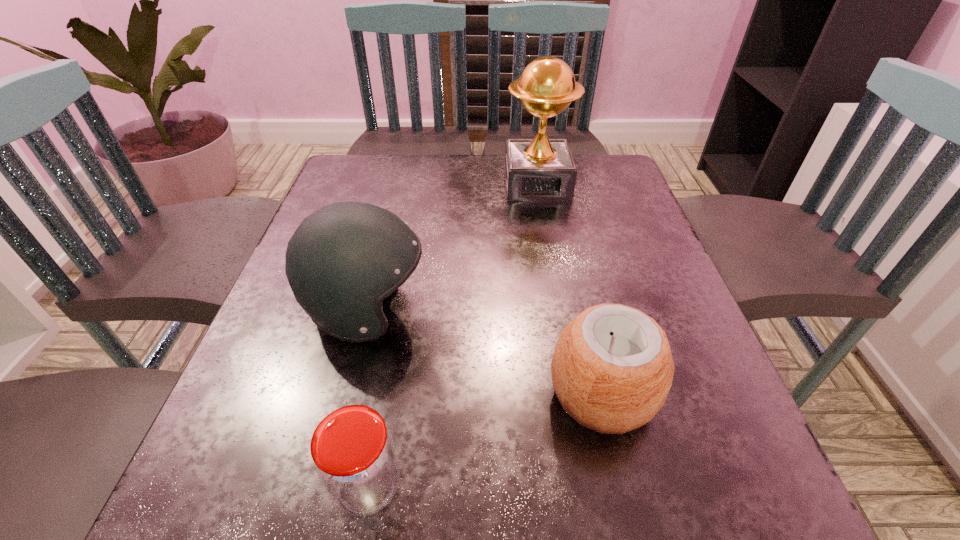
Find the location of a particular element. award is located at coordinates (541, 169).

You are a GUI agent. You are given a task and a screenshot of the screen. Output one action in this format:
    pyautogui.click(x=<x>, y=<y>)
    Task: Click on the farthest object
    
    Given the screenshot: What is the action you would take?
    pyautogui.click(x=541, y=169)

This screenshot has width=960, height=540. Find the location of `football helmet`. football helmet is located at coordinates (343, 260).

Locate an element on the screen. coconut is located at coordinates (612, 368).

The width and height of the screenshot is (960, 540). I want to click on jar, so click(354, 456).

Find the location of a particular element. This screenshot has height=540, width=960. the shortest object is located at coordinates (354, 456).

At what (x,y) coordinates should I click in order to perform the action: click on vacant space located 0.300m on the front-facing side of the tallest object. Please return your answer as a coordinate pair (x, y). Image resolution: width=960 pixels, height=540 pixels. Looking at the image, I should click on (556, 288).

Find the location of a particular element. vacant space located 0.160m at the face opening of the football helmet is located at coordinates (515, 309).

At what (x,y) coordinates should I click in order to perform the action: click on vacant area situated 0.050m on the right of the coconut. Please return your answer as a coordinate pair (x, y). This screenshot has height=540, width=960. Looking at the image, I should click on (686, 395).

Locate an element on the screen. The image size is (960, 540). vacant region located 0.110m on the right of the jar is located at coordinates (485, 485).